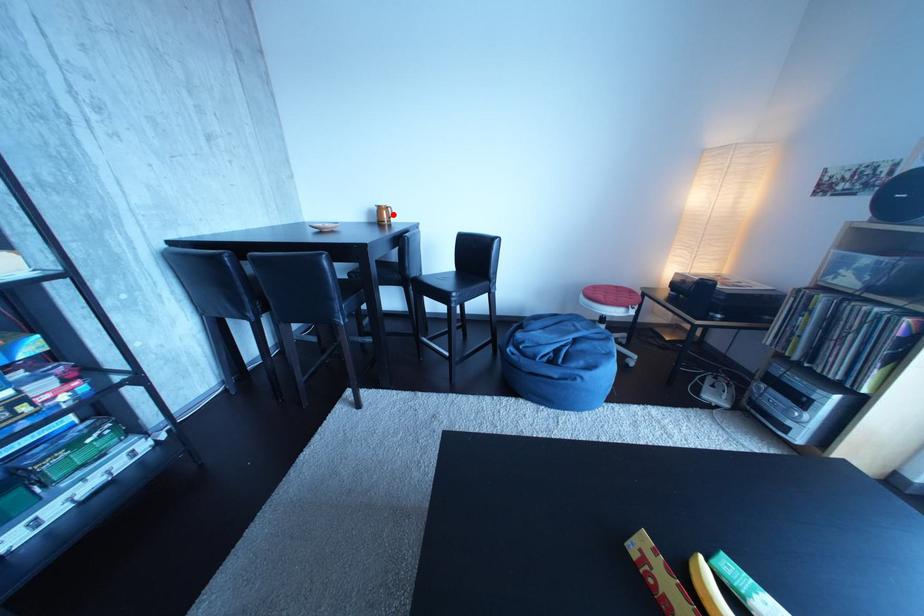
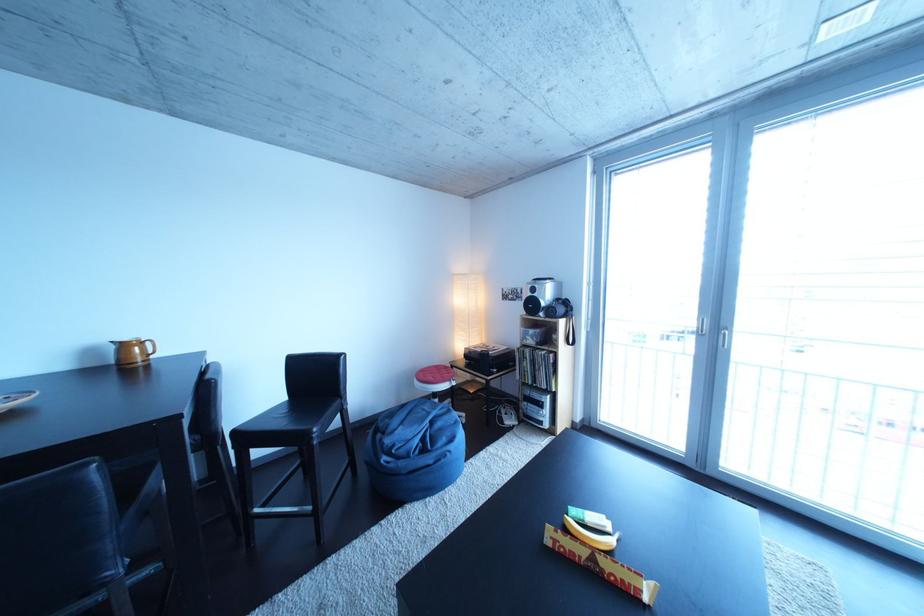
Question: I am providing you with two images of the same scene from different viewpoints. Image1 has a red point marked. In image2, the corresponding 3D location appears at what relative position? Reply with the corresponding letter.

Choices:
 (A) Closer
 (B) Farther

Answer: (B)